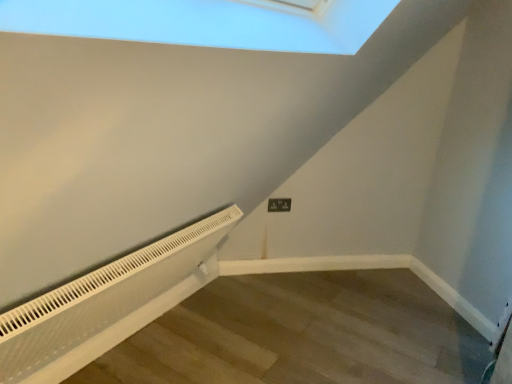
Question: Does white plastic electric outlet at center have a smaller size compared to white textured radiator at lower left?

Choices:
 (A) no
 (B) yes

Answer: (B)

Question: Is the surface of white plastic electric outlet at center in direct contact with white textured radiator at lower left?

Choices:
 (A) yes
 (B) no

Answer: (B)

Question: Considering the relative sizes of white plastic electric outlet at center and white textured radiator at lower left in the image provided, is white plastic electric outlet at center wider than white textured radiator at lower left?

Choices:
 (A) no
 (B) yes

Answer: (A)

Question: Is white plastic electric outlet at center looking in the opposite direction of white textured radiator at lower left?

Choices:
 (A) no
 (B) yes

Answer: (A)

Question: Is white plastic electric outlet at center oriented towards white textured radiator at lower left?

Choices:
 (A) yes
 (B) no

Answer: (B)

Question: Is white plastic electric outlet at center surrounding white textured radiator at lower left?

Choices:
 (A) yes
 (B) no

Answer: (B)

Question: Does white textured radiator at lower left lie in front of white plastic electric outlet at center?

Choices:
 (A) no
 (B) yes

Answer: (B)

Question: Is white textured radiator at lower left thinner than white plastic electric outlet at center?

Choices:
 (A) yes
 (B) no

Answer: (B)

Question: From a real-world perspective, does white textured radiator at lower left stand above white plastic electric outlet at center?

Choices:
 (A) no
 (B) yes

Answer: (A)

Question: Is white textured radiator at lower left completely or partially outside of white plastic electric outlet at center?

Choices:
 (A) no
 (B) yes

Answer: (B)

Question: Is white textured radiator at lower left further to camera compared to white plastic electric outlet at center?

Choices:
 (A) yes
 (B) no

Answer: (B)

Question: Is white textured radiator at lower left placed right next to white plastic electric outlet at center?

Choices:
 (A) yes
 (B) no

Answer: (B)

Question: Looking at the image, does white plastic electric outlet at center seem bigger or smaller compared to white textured radiator at lower left?

Choices:
 (A) big
 (B) small

Answer: (B)